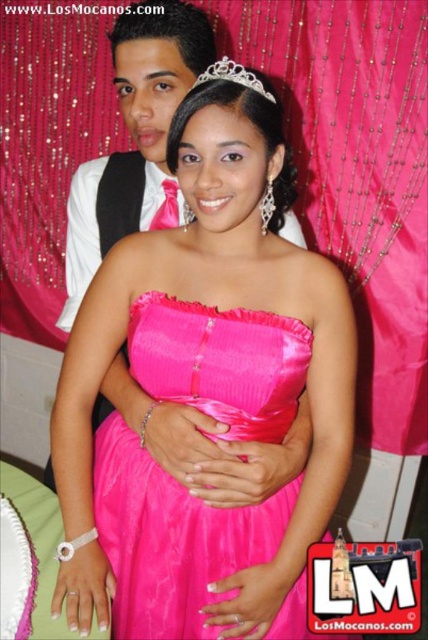
Question: Which of the following is the farthest from the observer?

Choices:
 (A) satin dress at center
 (B) silver metallic tiara at upper center
 (C) pink satin dress at center

Answer: (A)

Question: Which object appears farthest from the camera in this image?

Choices:
 (A) satin dress at center
 (B) pink satin dress at center

Answer: (A)

Question: Does pink satin dress at center appear on the left side of satin dress at center?

Choices:
 (A) no
 (B) yes

Answer: (A)

Question: Which is farther from the silver metallic tiara at upper center?

Choices:
 (A) satin dress at center
 (B) pink satin dress at center

Answer: (A)

Question: In this image, where is pink satin dress at center located relative to silver metallic tiara at upper center?

Choices:
 (A) left
 (B) right

Answer: (A)

Question: Does satin dress at center appear over silver metallic tiara at upper center?

Choices:
 (A) yes
 (B) no

Answer: (B)